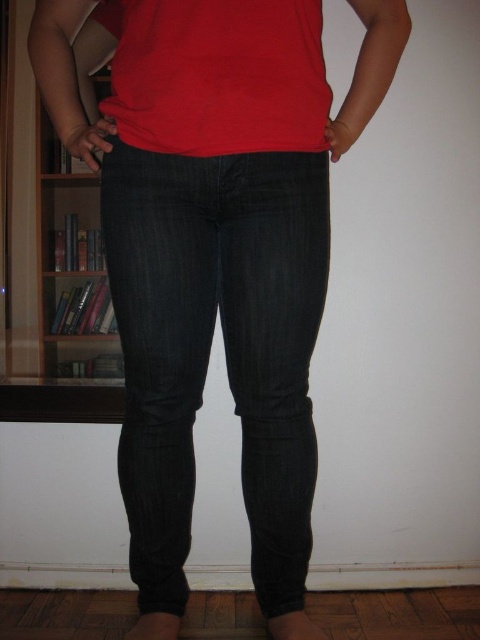
Question: Which of the following is the closest to the observer?

Choices:
 (A) wooden bookshelf at left
 (B) dark blue denim jeans at center

Answer: (B)

Question: Is dark blue denim jeans at center below matte red t-shirt at center?

Choices:
 (A) yes
 (B) no

Answer: (A)

Question: Is dark blue denim jeans at center closer to camera compared to wooden bookshelf at left?

Choices:
 (A) yes
 (B) no

Answer: (A)

Question: Which of these objects is positioned closest to the wooden bookshelf at left?

Choices:
 (A) matte red t-shirt at center
 (B) dark blue denim jeans at center

Answer: (B)

Question: Can you confirm if dark blue denim jeans at center is positioned to the left of wooden bookshelf at left?

Choices:
 (A) yes
 (B) no

Answer: (B)

Question: Among these points, which one is nearest to the camera?

Choices:
 (A) (310, 68)
 (B) (304, 388)

Answer: (A)